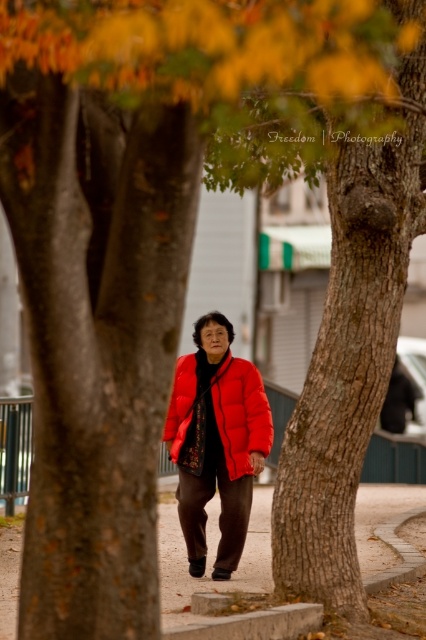
You are a delivery robot with a width of 1.5 meters. You are positioned on the smooth concrete pavement at center and need to move towards the matte red puffer jacket at center. Can you navigate the space between them without any obstacles?

The smooth concrete pavement at center and matte red puffer jacket at center are 2.37 meters apart. Since the robot is 1.5 meters wide, there is sufficient space to navigate between them without any issues.

You are standing at the point with coordinates (210, 556) in the autumn scene. What type of surface are you standing on?

The point at coordinates (210, 556) corresponds to smooth concrete pavement at center.